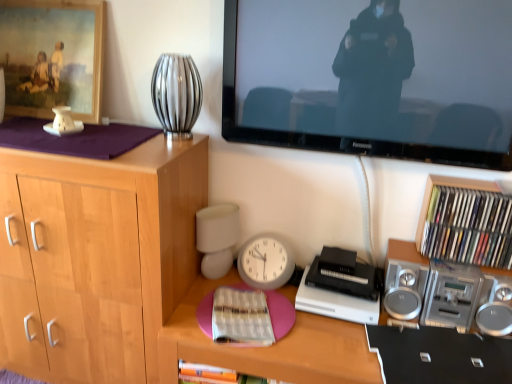
Question: Can you see silver metallic vase at upper center touching silver metallic stereo at right?

Choices:
 (A) yes
 (B) no

Answer: (B)

Question: Is silver metallic vase at upper center wider than silver metallic stereo at right?

Choices:
 (A) no
 (B) yes

Answer: (A)

Question: Is silver metallic vase at upper center at the right side of silver metallic stereo at right?

Choices:
 (A) no
 (B) yes

Answer: (A)

Question: Considering the relative sizes of silver metallic vase at upper center and silver metallic stereo at right in the image provided, is silver metallic vase at upper center smaller than silver metallic stereo at right?

Choices:
 (A) no
 (B) yes

Answer: (B)

Question: Does silver metallic vase at upper center have a larger size compared to silver metallic stereo at right?

Choices:
 (A) no
 (B) yes

Answer: (A)

Question: Is silver metallic stereo at right at the back of silver metallic vase at upper center?

Choices:
 (A) no
 (B) yes

Answer: (A)

Question: Is wooden framed painting at upper left further to the viewer compared to silver metallic vase at upper center?

Choices:
 (A) no
 (B) yes

Answer: (B)

Question: Is wooden framed painting at upper left shorter than silver metallic vase at upper center?

Choices:
 (A) yes
 (B) no

Answer: (B)

Question: Is wooden framed painting at upper left bigger than silver metallic vase at upper center?

Choices:
 (A) no
 (B) yes

Answer: (B)

Question: Can you confirm if wooden framed painting at upper left is positioned to the left of silver metallic vase at upper center?

Choices:
 (A) no
 (B) yes

Answer: (B)

Question: Can you confirm if wooden framed painting at upper left is taller than silver metallic vase at upper center?

Choices:
 (A) no
 (B) yes

Answer: (B)

Question: Is wooden framed painting at upper left in front of silver metallic vase at upper center?

Choices:
 (A) yes
 (B) no

Answer: (B)

Question: Is white paper book at center, acting as the 1th book starting from the bottom, taller than pink matte desk at center?

Choices:
 (A) no
 (B) yes

Answer: (A)